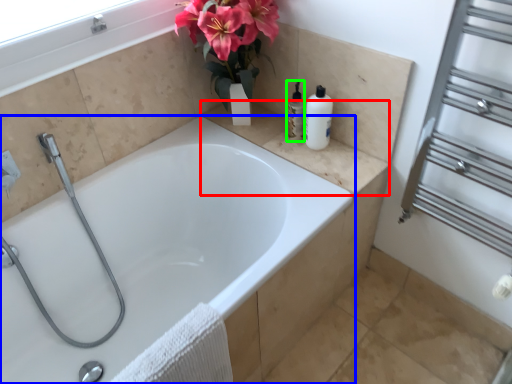
Question: Considering the real-world distances, which object is farthest from counter top (highlighted by a red box)? bathtub (highlighted by a blue box) or toiletry (highlighted by a green box)?

Choices:
 (A) bathtub
 (B) toiletry

Answer: (A)